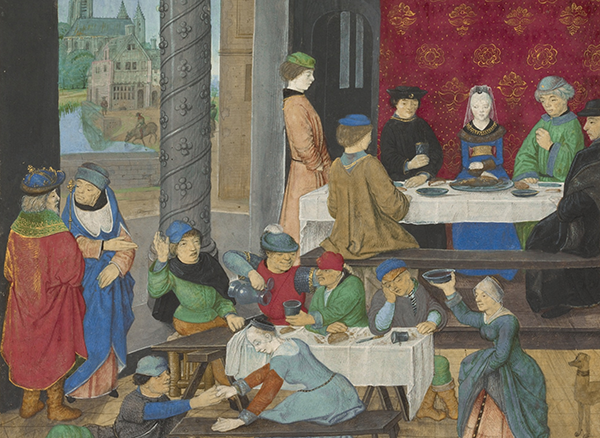
Where is `white table cloth`? The image size is (600, 438). white table cloth is located at coordinates (356, 351), (446, 206).